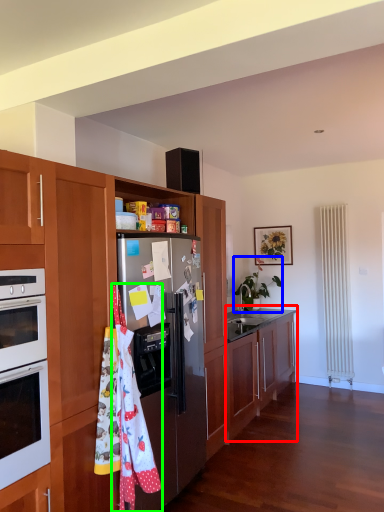
Question: Considering the real-world distances, which object is closest to cabinetry (highlighted by a red box)? houseplant (highlighted by a blue box) or material (highlighted by a green box).

Choices:
 (A) houseplant
 (B) material

Answer: (A)